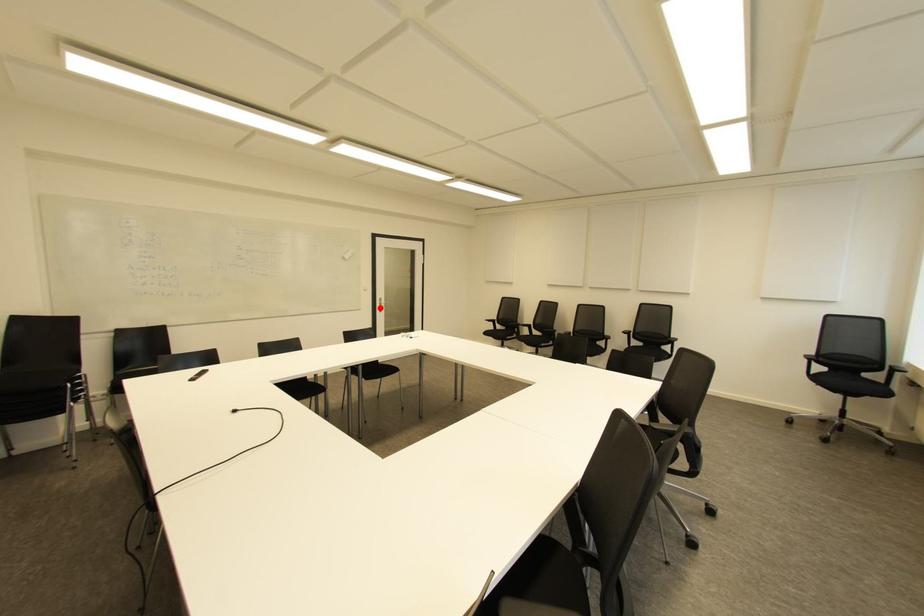
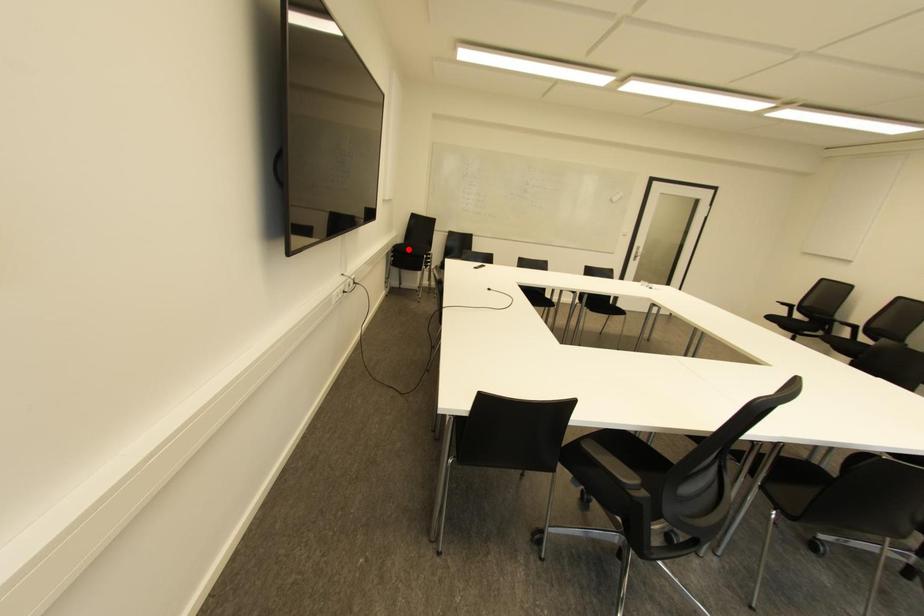
I am providing you with two images of the same scene from different viewpoints. A red point is marked on the first image and another point is marked on the second image. Is the marked point in image1 the same physical position as the marked point in image2?

No